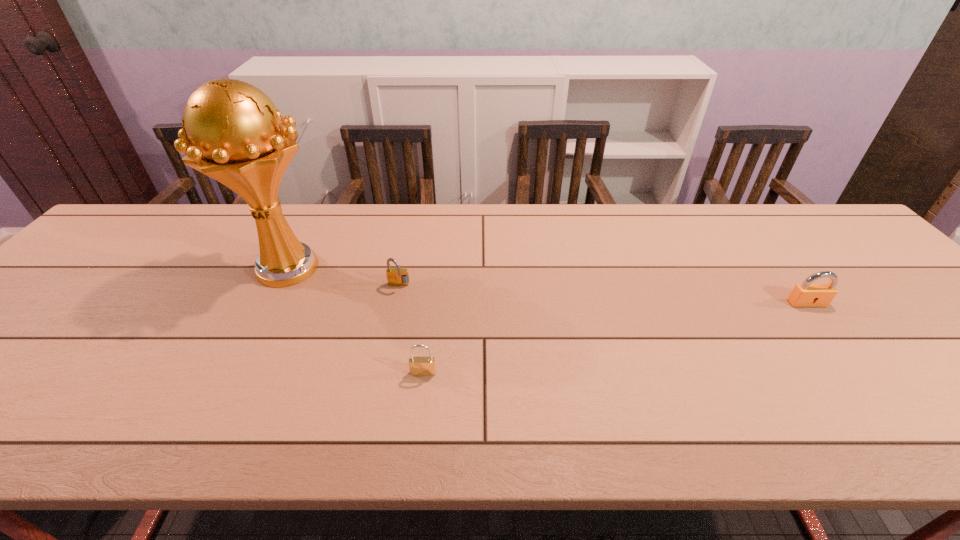
Where is `empty space that is in between the farthest padlock and the second nearest padlock`? empty space that is in between the farthest padlock and the second nearest padlock is located at coordinates (603, 295).

Locate an element on the screen. The height and width of the screenshot is (540, 960). empty location between the second object from right to left and the second object from left to right is located at coordinates (411, 329).

Locate an element on the screen. The width and height of the screenshot is (960, 540). unoccupied area between the nearest object and the leftmost padlock is located at coordinates (411, 329).

Where is `vacant point located between the leftmost padlock and the second padlock from left to right`? The image size is (960, 540). vacant point located between the leftmost padlock and the second padlock from left to right is located at coordinates (411, 329).

Identify the location of vacant space in between the rightmost object and the leftmost padlock. (603, 295).

Where is `empty location between the second farthest padlock and the tallest object`? The image size is (960, 540). empty location between the second farthest padlock and the tallest object is located at coordinates click(x=547, y=286).

Image resolution: width=960 pixels, height=540 pixels. Identify the location of object that stands as the closest to the third object from right to left. (232, 132).

Identify which object is the nearest to the leftmost padlock. Please provide its 2D coordinates. Your answer should be formatted as a tuple, i.e. [(x, y)], where the tuple contains the x and y coordinates of a point satisfying the conditions above.

[(232, 132)]

Find the location of a particular element. The height and width of the screenshot is (540, 960). padlock that is the second closest to the tallest object is located at coordinates (419, 366).

Image resolution: width=960 pixels, height=540 pixels. I want to click on padlock that is the second closest one to the rightmost object, so click(x=398, y=276).